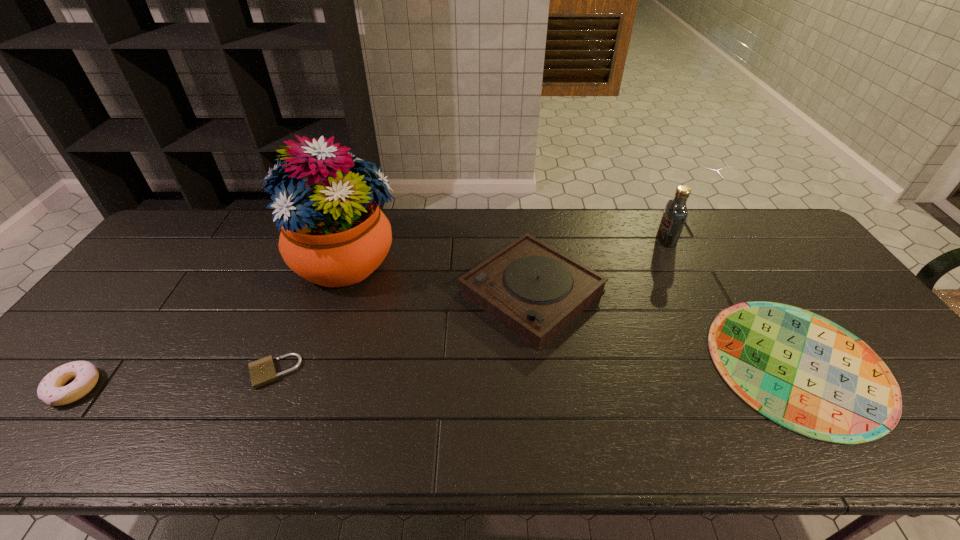
Locate an element on the screen. vacant position located on the front-facing side of the vodka is located at coordinates (618, 240).

The width and height of the screenshot is (960, 540). What are the coordinates of `free space located on the front-facing side of the vodka` in the screenshot? It's located at click(621, 240).

The height and width of the screenshot is (540, 960). In order to click on free point located on the right of the phonograph record in this screenshot , I will do `click(736, 292)`.

In order to click on vacant space situated 0.240m on the right of the third shortest object in this screenshot , I will do `click(200, 388)`.

Where is `free location located 0.330m on the right of the padlock`? This screenshot has width=960, height=540. free location located 0.330m on the right of the padlock is located at coordinates (435, 372).

Locate an element on the screen. The image size is (960, 540). vacant space situated on the left of the gameboard is located at coordinates (x=601, y=364).

At what (x,y) coordinates should I click in order to perform the action: click on flower arrangement positioned at the far edge. Please return your answer as a coordinate pair (x, y). Looking at the image, I should click on (333, 233).

This screenshot has width=960, height=540. In order to click on vodka located at the far edge in this screenshot , I will do `click(675, 214)`.

Identify the location of phonograph record present at the far edge. (534, 290).

Identify the location of object that is positioned at the near edge. The width and height of the screenshot is (960, 540). (802, 371).